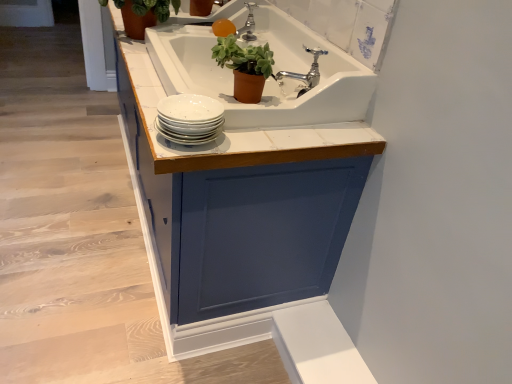
I want to click on vacant area that is in front of green matte plant pot at upper center, which is the first houseplant in front-to-back order, so click(248, 132).